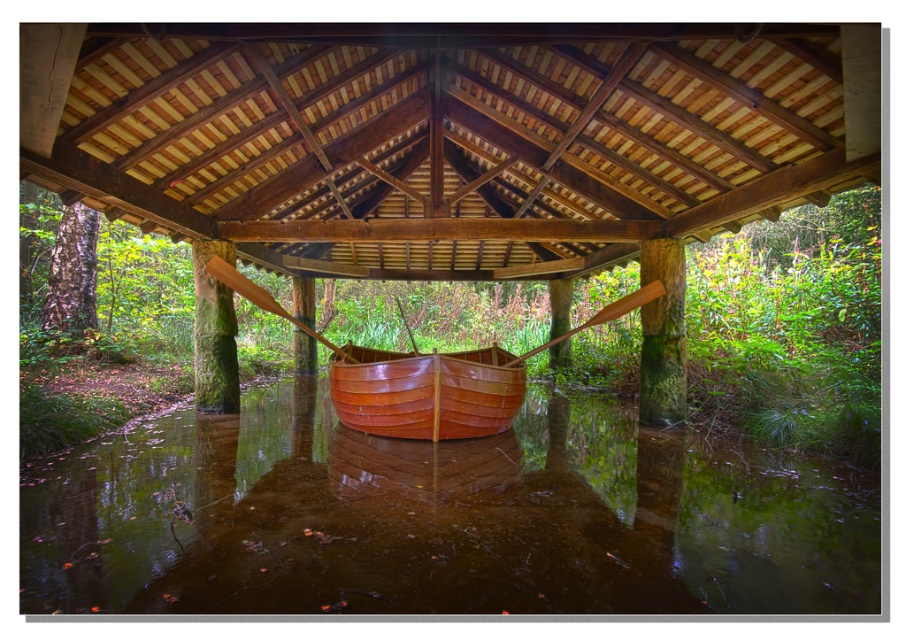
Question: Which point is closer to the camera?

Choices:
 (A) shiny brown canoe at center
 (B) glossy wooden boat at center

Answer: (B)

Question: Which of the following is the closest to the observer?

Choices:
 (A) click(319, 380)
 (B) click(387, 372)

Answer: (B)

Question: Is glossy wooden boat at center thinner than shiny brown canoe at center?

Choices:
 (A) yes
 (B) no

Answer: (B)

Question: Is glossy wooden boat at center smaller than shiny brown canoe at center?

Choices:
 (A) no
 (B) yes

Answer: (B)

Question: Is glossy wooden boat at center to the right of shiny brown canoe at center from the viewer's perspective?

Choices:
 (A) no
 (B) yes

Answer: (B)